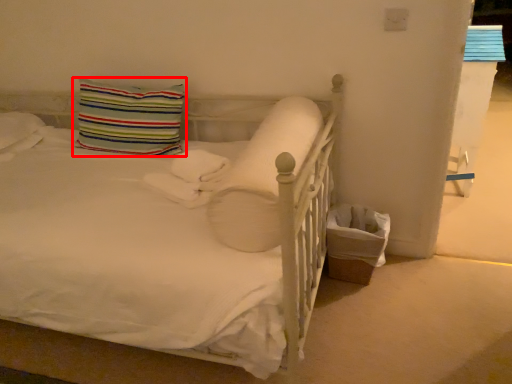
Question: From the image's perspective, what is the correct spatial positioning of pillow (annotated by the red box) in reference to pillow?

Choices:
 (A) above
 (B) below

Answer: (A)